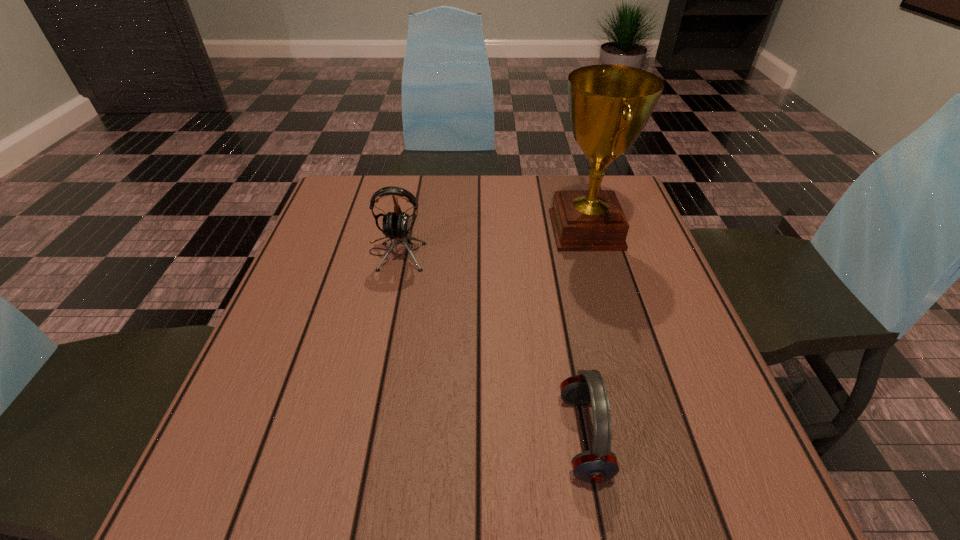
The width and height of the screenshot is (960, 540). Find the location of `vacant point located between the shorter earphone and the award`. vacant point located between the shorter earphone and the award is located at coordinates (585, 334).

Locate an element on the screen. The width and height of the screenshot is (960, 540). unoccupied position between the left earphone and the shortest object is located at coordinates (490, 345).

Select which object is the second closest to the second tallest object. Please provide its 2D coordinates. Your answer should be formatted as a tuple, i.e. [(x, y)], where the tuple contains the x and y coordinates of a point satisfying the conditions above.

[(599, 465)]

Find the location of `object that can be found as the closest to the second shortest object`. object that can be found as the closest to the second shortest object is located at coordinates (609, 105).

You are a GUI agent. You are given a task and a screenshot of the screen. Output one action in this format:
    pyautogui.click(x=<x>, y=<y>)
    Task: Click on the vacant area that satisfies the following two spatial constraints: 1. on the plaque of the tallest object; 2. on the front side of the farther earphone
    The image size is (960, 540).
    Given the screenshot: What is the action you would take?
    pyautogui.click(x=592, y=253)